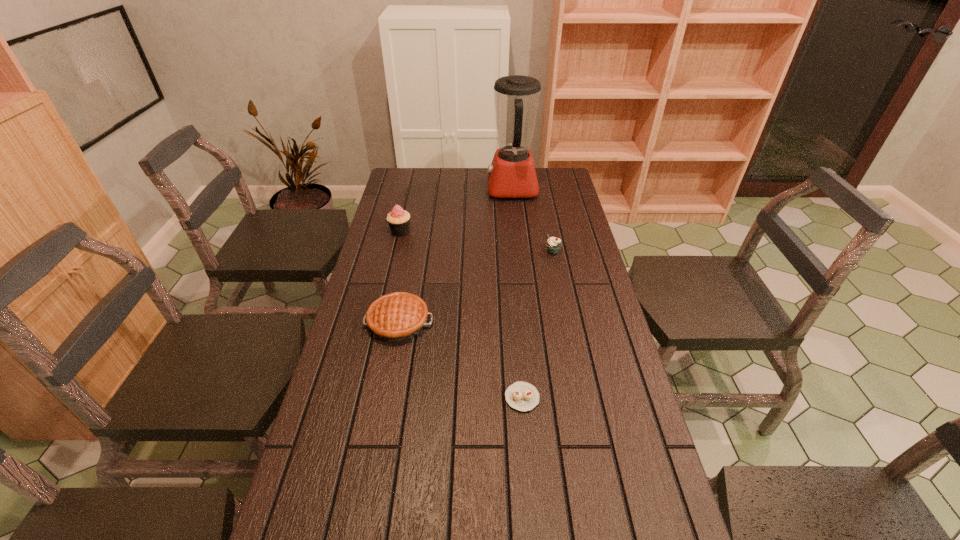
At what (x,y) coordinates should I click in order to perform the action: click on free space between the tallest object and the pie. Please return your answer as a coordinate pair (x, y). Image resolution: width=960 pixels, height=540 pixels. Looking at the image, I should click on (455, 256).

In order to click on empty space that is in between the nearest object and the second tallest cupcake in this screenshot , I will do `click(538, 325)`.

Where is `free area in between the tallest object and the farthest cupcake`? free area in between the tallest object and the farthest cupcake is located at coordinates (456, 210).

Where is `empty location between the tallest object and the leftmost cupcake`? empty location between the tallest object and the leftmost cupcake is located at coordinates (456, 210).

Image resolution: width=960 pixels, height=540 pixels. Find the location of `free spot between the rightmost cupcake and the second farthest object`. free spot between the rightmost cupcake and the second farthest object is located at coordinates (476, 241).

Identify the location of free space between the nearest cupcake and the blender. The image size is (960, 540). (517, 293).

Identify which object is the fourth nearest to the second nearest object. Please provide its 2D coordinates. Your answer should be formatted as a tuple, i.e. [(x, y)], where the tuple contains the x and y coordinates of a point satisfying the conditions above.

[(512, 174)]

Select which object appears as the closest to the blender. Please provide its 2D coordinates. Your answer should be formatted as a tuple, i.e. [(x, y)], where the tuple contains the x and y coordinates of a point satisfying the conditions above.

[(553, 244)]

Identify which cupcake is the nearest to the third farthest object. Please provide its 2D coordinates. Your answer should be formatted as a tuple, i.e. [(x, y)], where the tuple contains the x and y coordinates of a point satisfying the conditions above.

[(398, 219)]

The image size is (960, 540). What are the coordinates of `cupcake that is the nearest to the blender` in the screenshot? It's located at (553, 244).